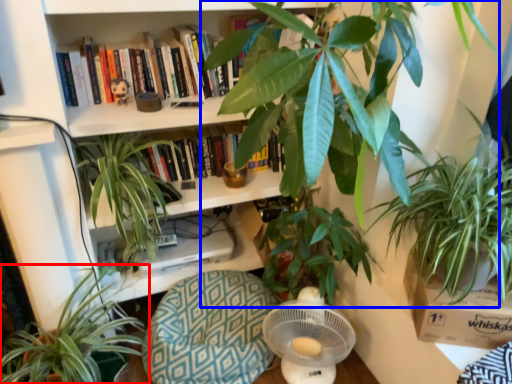
Question: Which point is further to the camera, houseplant (highlighted by a red box) or houseplant (highlighted by a blue box)?

Choices:
 (A) houseplant
 (B) houseplant

Answer: (A)